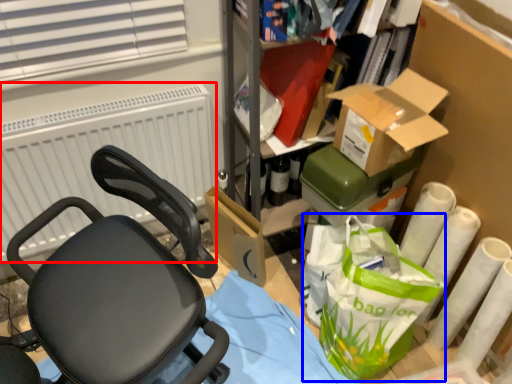
Question: Which object appears closest to the camera in this image, radiator (highlighted by a red box) or shopping bag (highlighted by a blue box)?

Choices:
 (A) radiator
 (B) shopping bag

Answer: (B)